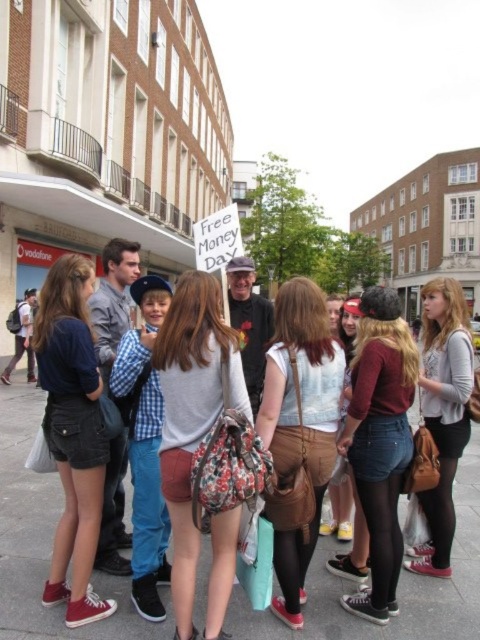
Does concrete pavement at center have a greater width compared to checkered fabric shirt at center?

Yes.

Who is more distant from viewer, (420, 588) or (144, 420)?

Positioned behind is point (144, 420).

Locate an element on the screen. The image size is (480, 640). concrete pavement at center is located at coordinates (45, 540).

Can you confirm if denim shorts at left is shorter than matte gray sweater at center?

Incorrect, denim shorts at left's height does not fall short of matte gray sweater at center's.

What are the coordinates of `denim shorts at left` in the screenshot? It's located at (72, 433).

What do you see at coordinates (144, 444) in the screenshot?
I see `checkered fabric shirt at center` at bounding box center [144, 444].

The image size is (480, 640). Describe the element at coordinates (144, 444) in the screenshot. I see `checkered fabric shirt at center` at that location.

The height and width of the screenshot is (640, 480). In order to click on checkered fabric shirt at center in this screenshot , I will do `click(144, 444)`.